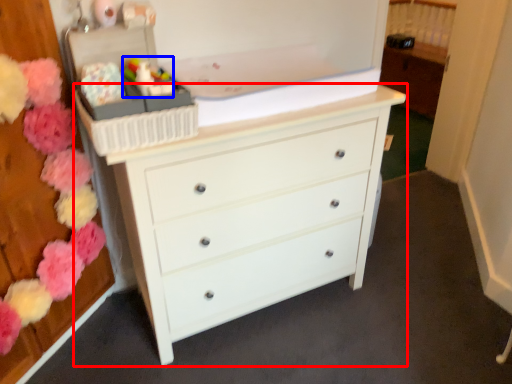
Question: Which object appears farthest to the camera in this image, chest of drawers (highlighted by a red box) or toy (highlighted by a blue box)?

Choices:
 (A) chest of drawers
 (B) toy

Answer: (B)